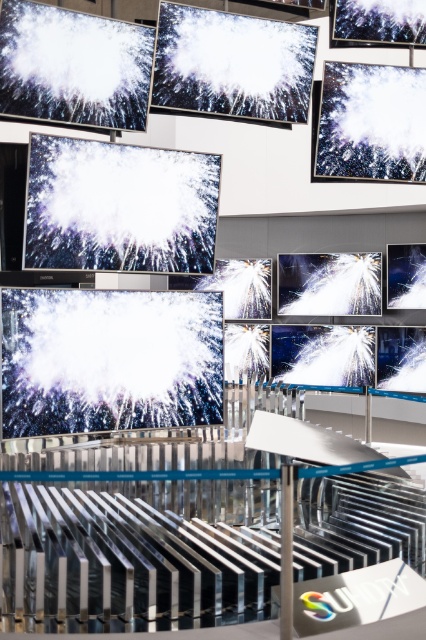
You are a customer standing in front of the retail display. You see a point marked at coordinates (109,358). What object is located at that point?

The point at coordinates (109,358) marks the white glossy monitor at center.

You are a customer in the store and want to see both the white glossy screen at center and the matte black monitor at center. Which one do you need to look up at to view?

The white glossy screen at center is located above the matte black monitor at center, so you need to look up to view the white glossy screen at center.

You are a customer in the store and want to take a photo of both the white glossy screen at center and the white glossy water at upper right. Which object should you focus on first to ensure both are in frame?

You should focus on the white glossy screen at center first since it is positioned on the left side of the white glossy water at upper right, so by centering the screen, the water will naturally be in the frame to its right.